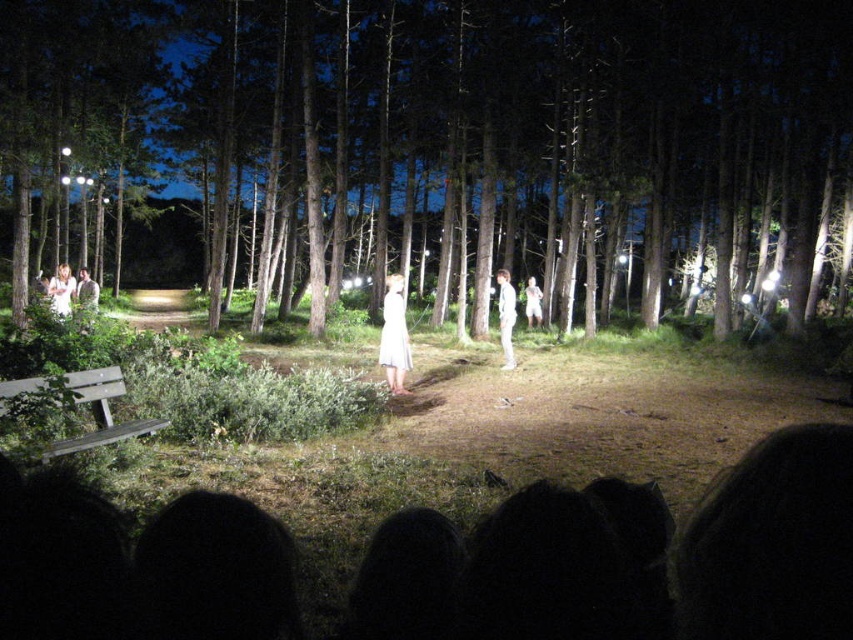
Is brown wood tree at center closer to camera compared to white cotton dress at center?

Yes, it is in front of white cotton dress at center.

Is point (212, 131) closer to viewer compared to point (526, 288)?

Yes, it is.

Is point (288, 209) positioned before point (538, 310)?

Yes.

Locate an element on the screen. The height and width of the screenshot is (640, 853). brown wood tree at center is located at coordinates (439, 148).

Is point (387, 232) positioned before point (502, 272)?

No, it is behind (502, 272).

Who is positioned more to the right, brown wood tree at center or white fabric dress at center?

From the viewer's perspective, white fabric dress at center appears more on the right side.

The height and width of the screenshot is (640, 853). Find the location of `brown wood tree at center`. brown wood tree at center is located at coordinates (439, 148).

Can you confirm if wooden bench at lower left is positioned to the left of white fabric dress at center?

Yes, wooden bench at lower left is to the left of white fabric dress at center.

Who is more distant from viewer, (10, 390) or (502, 346)?

Positioned behind is point (502, 346).

Between point (7, 396) and point (508, 340), which one is positioned in front?

Positioned in front is point (7, 396).

What are the coordinates of `wooden bench at lower left` in the screenshot? It's located at (99, 412).